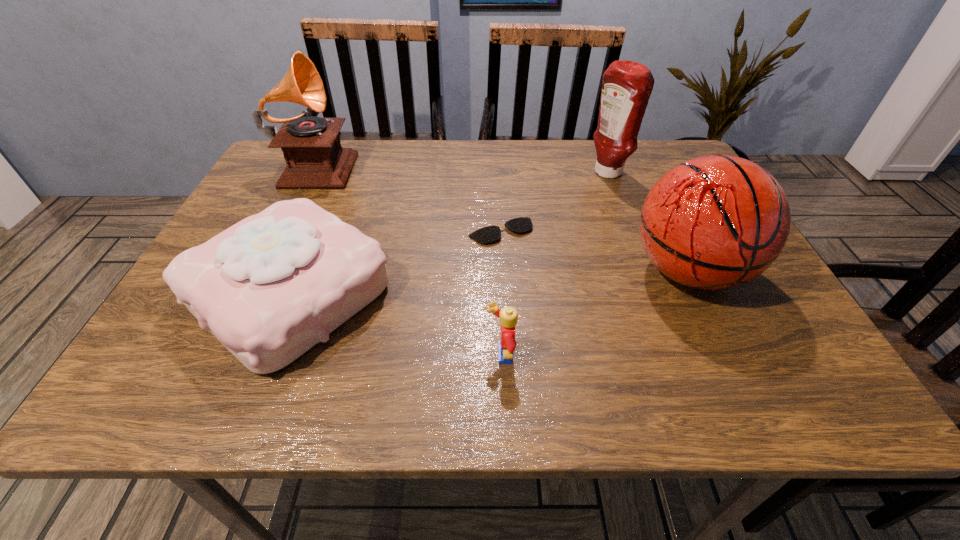
You are a GUI agent. You are given a task and a screenshot of the screen. Output one action in this format:
    pyautogui.click(x=<x>, y=<y>)
    Task: Click on the free spot between the shortest object and the phonograph record
    The height and width of the screenshot is (540, 960).
    Given the screenshot: What is the action you would take?
    pyautogui.click(x=409, y=198)

At what (x,y) coordinates should I click in order to perform the action: click on vacant space in between the condiment and the fifth tallest object. Please return your answer as a coordinate pair (x, y). Looking at the image, I should click on (554, 265).

Identify the location of vacant area that lies between the phonograph record and the shortest object. Image resolution: width=960 pixels, height=540 pixels. (409, 198).

You are a GUI agent. You are given a task and a screenshot of the screen. Output one action in this format:
    pyautogui.click(x=<x>, y=<y>)
    Task: Click on the free space between the phonograph record and the Lego
    
    Given the screenshot: What is the action you would take?
    coord(408,260)

This screenshot has width=960, height=540. I want to click on blank region between the fifth tallest object and the spectacles, so click(500, 294).

This screenshot has height=540, width=960. Find the location of `free space between the condiment and the shortest object`. free space between the condiment and the shortest object is located at coordinates (554, 202).

Where is `the fifth closest object relative to the phonograph record`? the fifth closest object relative to the phonograph record is located at coordinates (714, 222).

Identify the location of object that ranks as the fifth closest to the cake. Image resolution: width=960 pixels, height=540 pixels. (627, 86).

The height and width of the screenshot is (540, 960). What are the coordinates of `free space in the image that satisfies the following two spatial constraints: 1. on the horn of the cake; 2. on the right side of the phonograph record` in the screenshot? It's located at (252, 293).

Image resolution: width=960 pixels, height=540 pixels. Find the location of `vacant region that satisfies the following two spatial constraints: 1. on the front side of the spectacles; 2. on the face of the second shortest object`. vacant region that satisfies the following two spatial constraints: 1. on the front side of the spectacles; 2. on the face of the second shortest object is located at coordinates (507, 356).